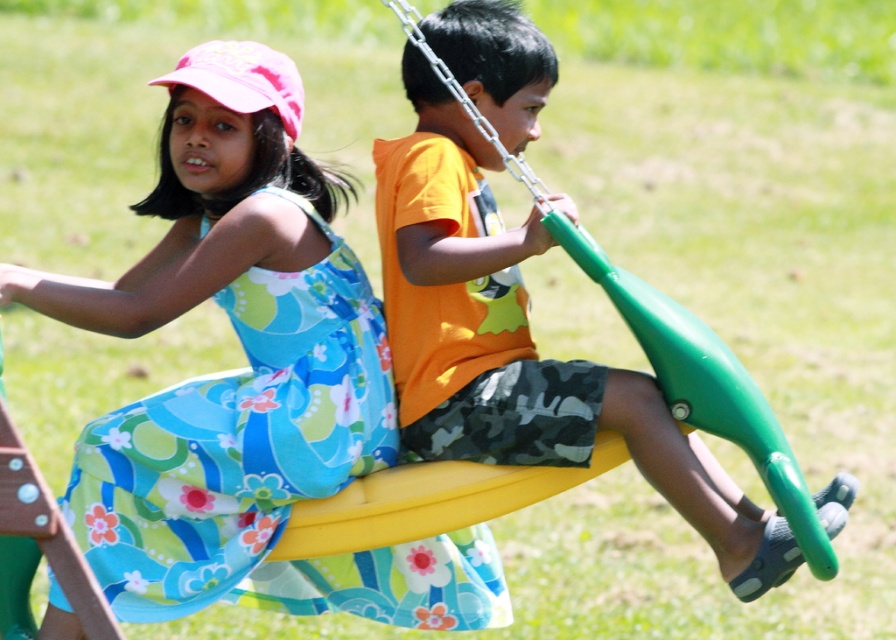
Question: Is floral fabric dress at left thinner than green rubber swing at center?

Choices:
 (A) no
 (B) yes

Answer: (B)

Question: Observing the image, what is the correct spatial positioning of floral fabric dress at left in reference to green rubber swing at center?

Choices:
 (A) below
 (B) above

Answer: (A)

Question: Which object is farther from the camera taking this photo?

Choices:
 (A) green rubber swing at center
 (B) floral fabric dress at left

Answer: (B)

Question: Is floral fabric dress at left thinner than green rubber swing at center?

Choices:
 (A) yes
 (B) no

Answer: (A)

Question: Which point is closer to the camera?

Choices:
 (A) pos(437,419)
 (B) pos(283,349)

Answer: (A)